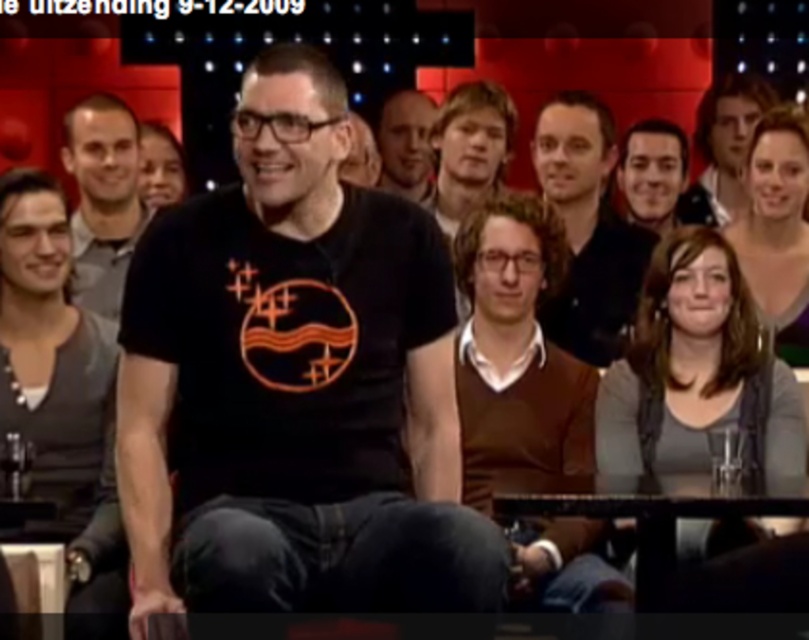
Question: Which object is the closest to the matte black shirt at center?

Choices:
 (A) matte black shirt at upper right
 (B) matte black t-shirt at center

Answer: (A)

Question: Is black matte t-shirt at center positioned at the back of matte black shirt at upper right?

Choices:
 (A) no
 (B) yes

Answer: (A)

Question: Which point is closer to the camera?

Choices:
 (A) pos(426,189)
 (B) pos(498,413)

Answer: (B)

Question: Can you confirm if brown sweater vest at center is positioned below matte black shirt at left?

Choices:
 (A) yes
 (B) no

Answer: (A)

Question: Can you confirm if matte black shirt at upper center is smaller than smooth skin face at upper center?

Choices:
 (A) yes
 (B) no

Answer: (A)

Question: Which object is farther from the camera taking this photo?

Choices:
 (A) black matte t-shirt at center
 (B) brown sweater vest at center

Answer: (B)